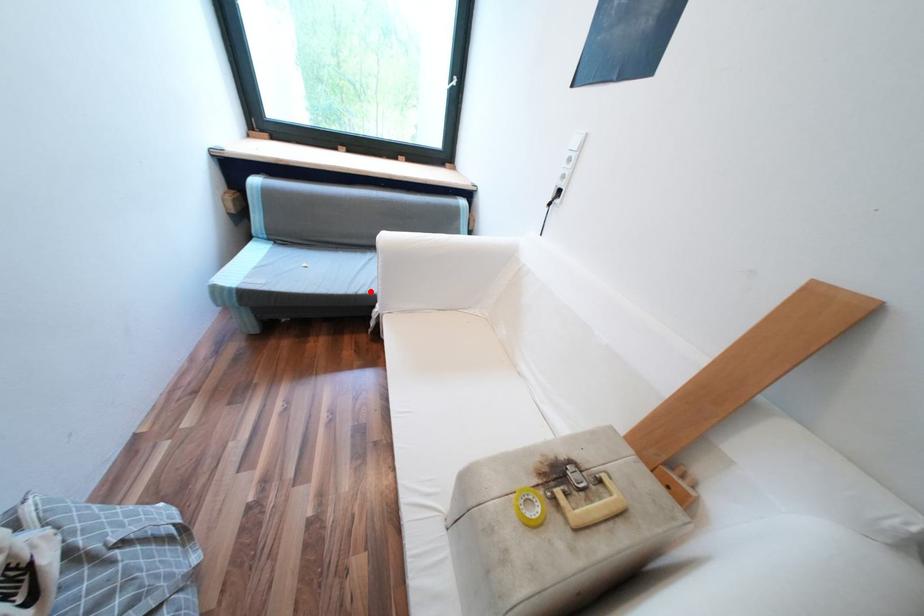
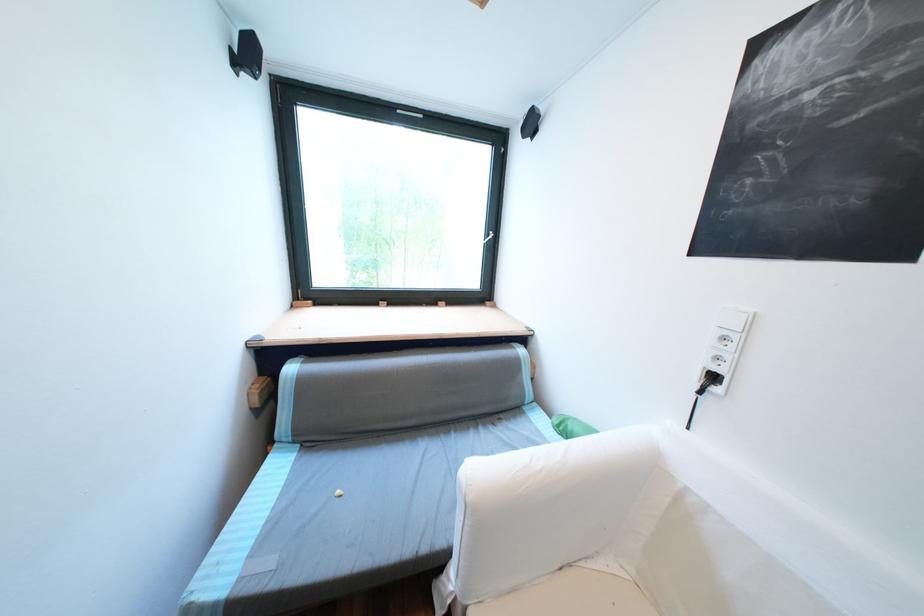
Question: I am providing you with two images of the same scene from different viewpoints. A red point is marked on the first image. At the location where the point appears in image 1, is it still visible in image 2?

Choices:
 (A) Yes
 (B) No

Answer: (A)